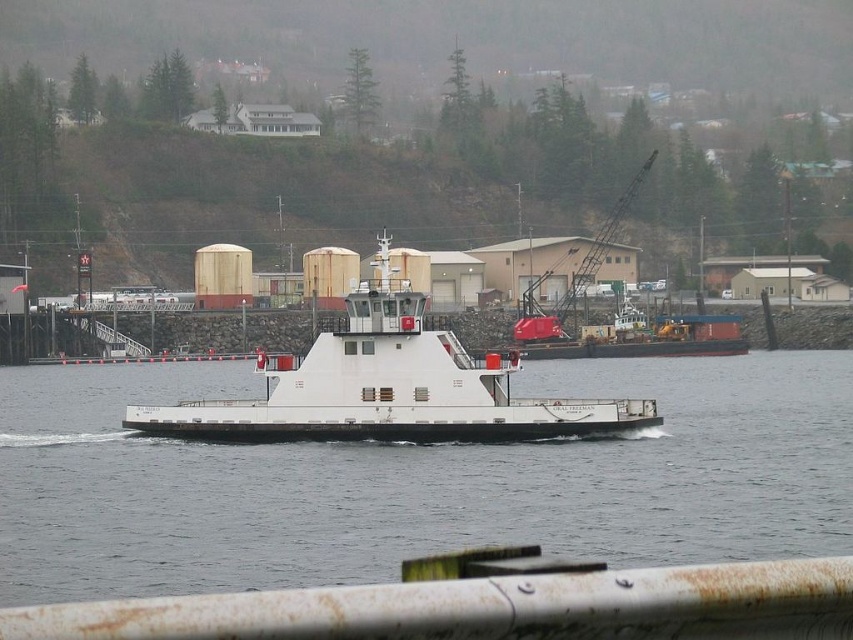
Question: Which point is closer to the camera?

Choices:
 (A) click(x=788, y=492)
 (B) click(x=344, y=394)

Answer: (A)

Question: Does white matte water at center appear on the right side of white matte boat at center?

Choices:
 (A) yes
 (B) no

Answer: (A)

Question: In this image, where is white matte water at center located relative to white matte boat at center?

Choices:
 (A) above
 (B) below

Answer: (B)

Question: Can you confirm if white matte water at center is positioned below white matte boat at center?

Choices:
 (A) no
 (B) yes

Answer: (B)